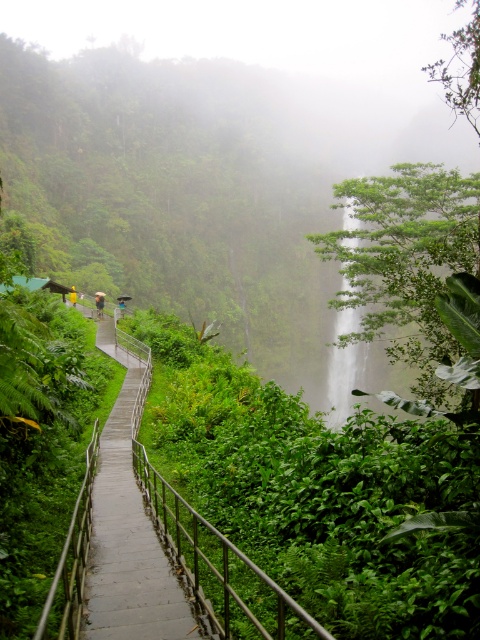
Question: Which point appears closest to the camera in this image?

Choices:
 (A) tap(345, 396)
 (B) tap(167, 534)

Answer: (B)

Question: Can you confirm if metallic silver rail at left is positioned below green leafy waterfall at center?

Choices:
 (A) no
 (B) yes

Answer: (B)

Question: Which object appears closest to the camera in this image?

Choices:
 (A) metallic silver rail at left
 (B) green leafy waterfall at center

Answer: (A)

Question: Which point appears farthest from the camera in this image?

Choices:
 (A) (348, 321)
 (B) (180, 497)

Answer: (A)

Question: Does metallic silver rail at left have a smaller size compared to green leafy waterfall at center?

Choices:
 (A) yes
 (B) no

Answer: (A)

Question: Is metallic silver rail at left positioned in front of green leafy waterfall at center?

Choices:
 (A) yes
 (B) no

Answer: (A)